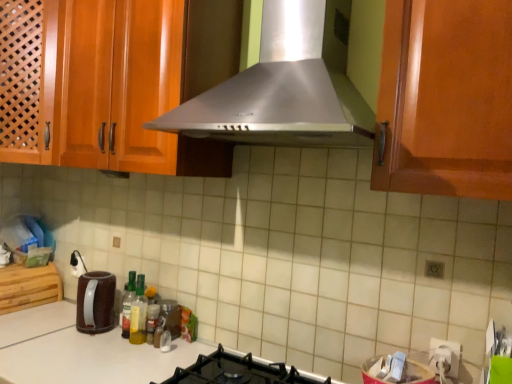
The height and width of the screenshot is (384, 512). Describe the element at coordinates (128, 304) in the screenshot. I see `translucent glass bottle at center, the third bottle positioned from the right` at that location.

Identify the location of translucent plastic bottle at center, the 3th bottle in the left-to-right sequence. (152, 321).

The height and width of the screenshot is (384, 512). Describe the element at coordinates (170, 316) in the screenshot. I see `metallic glass jar at center` at that location.

What is the approximate width of metallic glass jar at center?

It is 5.73 centimeters.

Find the location of a particular element. Image resolution: width=512 pixels, height=384 pixels. stainless steel range hood at center is located at coordinates (285, 87).

Find the location of a particular element. The height and width of the screenshot is (384, 512). brown matte electric kettle at lower left is located at coordinates (95, 302).

From the image's perspective, is stainless steel range hood at center located above brown matte electric kettle at lower left?

Yes, from the image's perspective, stainless steel range hood at center is above brown matte electric kettle at lower left.

Where is `kitchen appliance below the stainless steel range hood at center (from the image's perspective)`? kitchen appliance below the stainless steel range hood at center (from the image's perspective) is located at coordinates (95, 302).

Are stainless steel range hood at center and brown matte electric kettle at lower left making contact?

No, stainless steel range hood at center is not touching brown matte electric kettle at lower left.

From the picture: Which object is positioned more to the right, stainless steel range hood at center or brown matte electric kettle at lower left?

stainless steel range hood at center.

Is stainless steel range hood at center far from translucent plastic bottle at center, arranged as the second bottle when viewed from the right?

stainless steel range hood at center is actually quite close to translucent plastic bottle at center, arranged as the second bottle when viewed from the right.

Is point (308, 17) positioned after point (141, 286)?

No.

From the image's perspective, is stainless steel range hood at center located above or below translucent plastic bottle at center, the second bottle when ordered from left to right?

stainless steel range hood at center is situated higher than translucent plastic bottle at center, the second bottle when ordered from left to right, in the image.

Can you confirm if metallic glass jar at center is shorter than brown matte electric kettle at lower left?

Indeed, metallic glass jar at center has a lesser height compared to brown matte electric kettle at lower left.

From a real-world perspective, is metallic glass jar at center positioned under brown matte electric kettle at lower left based on gravity?

Yes, from a real-world perspective, metallic glass jar at center is beneath brown matte electric kettle at lower left.

Who is bigger, metallic glass jar at center or brown matte electric kettle at lower left?

brown matte electric kettle at lower left.

Which object is further away from the camera taking this photo, metallic glass jar at center or brown matte electric kettle at lower left?

metallic glass jar at center.

Measure the distance between translucent plastic bottle at center, arranged as the second bottle when viewed from the right, and translucent glass bottle at center, the third bottle positioned from the right.

translucent plastic bottle at center, arranged as the second bottle when viewed from the right, and translucent glass bottle at center, the third bottle positioned from the right, are 1.79 inches apart.

Is translucent plastic bottle at center, arranged as the second bottle when viewed from the right, oriented away from translucent glass bottle at center, the 1th bottle from the left?

No, translucent plastic bottle at center, arranged as the second bottle when viewed from the right, is not facing the opposite direction of translucent glass bottle at center, the 1th bottle from the left.

From the image's perspective, is translucent plastic bottle at center, arranged as the second bottle when viewed from the right, under translucent glass bottle at center, the 1th bottle from the left?

Correct, translucent plastic bottle at center, arranged as the second bottle when viewed from the right, appears lower than translucent glass bottle at center, the 1th bottle from the left, in the image.

Consider the image. Is translucent plastic bottle at center, the second bottle when ordered from left to right, thinner than translucent glass bottle at center, the 1th bottle from the left?

Yes.

In the scene shown: Is wooden cutting board at lower left not near translucent plastic bottle at center, arranged as the second bottle when viewed from the right?

Actually, wooden cutting board at lower left and translucent plastic bottle at center, arranged as the second bottle when viewed from the right, are a little close together.

Is point (59, 294) in front of point (144, 285)?

No.

Can you confirm if wooden cutting board at lower left is positioned to the right of translucent plastic bottle at center, the second bottle when ordered from left to right?

No, wooden cutting board at lower left is not to the right of translucent plastic bottle at center, the second bottle when ordered from left to right.

Can you confirm if wooden cutting board at lower left is smaller than translucent plastic bottle at center, the second bottle when ordered from left to right?

No, wooden cutting board at lower left is not smaller than translucent plastic bottle at center, the second bottle when ordered from left to right.

From their relative heights in the image, would you say black matte gas stove at lower center is taller or shorter than translucent glass bottle at center, the third bottle positioned from the right?

black matte gas stove at lower center is shorter than translucent glass bottle at center, the third bottle positioned from the right.

Measure the distance between black matte gas stove at lower center and translucent glass bottle at center, the 1th bottle from the left.

black matte gas stove at lower center is 18.85 inches from translucent glass bottle at center, the 1th bottle from the left.

Would you say black matte gas stove at lower center is a long distance from translucent glass bottle at center, the 1th bottle from the left?

They are positioned close to each other.

How many degrees apart are the facing directions of black matte gas stove at lower center and translucent glass bottle at center, the third bottle positioned from the right?

They differ by 0.461 degrees in their facing directions.

Which object is positioned more to the left, brown matte electric kettle at lower left or stainless steel range hood at center?

brown matte electric kettle at lower left.

Is brown matte electric kettle at lower left taller or shorter than stainless steel range hood at center?

Clearly, brown matte electric kettle at lower left is shorter compared to stainless steel range hood at center.

Consider the image. Are brown matte electric kettle at lower left and stainless steel range hood at center beside each other?

No, brown matte electric kettle at lower left is not with stainless steel range hood at center.

How many degrees apart are the facing directions of brown matte electric kettle at lower left and stainless steel range hood at center?

0.308 degrees separate the facing orientations of brown matte electric kettle at lower left and stainless steel range hood at center.

At what (x,y) coordinates should I click in order to perform the action: click on kitchen appliance behind the stainless steel range hood at center. Please return your answer as a coordinate pair (x, y). The height and width of the screenshot is (384, 512). Looking at the image, I should click on (95, 302).

Locate an element on the screen. The height and width of the screenshot is (384, 512). home appliance above the translucent plastic bottle at center, the second bottle when ordered from left to right (from the image's perspective) is located at coordinates (285, 87).

Looking at the image, which one is located closer to translucent plastic bottle at center, arranged as the second bottle when viewed from the right, metallic glass jar at center or black matte gas stove at lower center?

metallic glass jar at center lies closer to translucent plastic bottle at center, arranged as the second bottle when viewed from the right, than the other object.

From the image, which object appears to be nearer to translucent glass bottle at center, the 1th bottle from the left, brown matte electric kettle at lower left or black matte gas stove at lower center?

brown matte electric kettle at lower left is closer to translucent glass bottle at center, the 1th bottle from the left.

Looking at the image, which one is located further to black matte gas stove at lower center, translucent glass bottle at center, the 1th bottle from the left, or stainless steel range hood at center?

Among the two, stainless steel range hood at center is located further to black matte gas stove at lower center.

Looking at the image, which one is located closer to black matte gas stove at lower center, translucent plastic bottle at center, the second bottle when ordered from left to right, or translucent glass bottle at center, the 1th bottle from the left?

translucent plastic bottle at center, the second bottle when ordered from left to right, is positioned closer to the anchor black matte gas stove at lower center.

Considering their positions, is translucent glass bottle at center, the third bottle positioned from the right, positioned further to brown matte electric kettle at lower left than black matte gas stove at lower center?

black matte gas stove at lower center.

Estimate the real-world distances between objects in this image. Which object is closer to black matte gas stove at lower center, metallic glass jar at center or wooden cutting board at lower left?

Based on the image, metallic glass jar at center appears to be nearer to black matte gas stove at lower center.

When comparing their distances from black matte gas stove at lower center, does wooden cutting board at lower left or translucent glass bottle at center, the third bottle positioned from the right, seem closer?

translucent glass bottle at center, the third bottle positioned from the right, lies closer to black matte gas stove at lower center than the other object.

Estimate the real-world distances between objects in this image. Which object is closer to wooden cutting board at lower left, translucent glass bottle at center, the third bottle positioned from the right, or translucent plastic bottle at center, the 1th bottle when ordered from right to left?

translucent glass bottle at center, the third bottle positioned from the right, is positioned closer to the anchor wooden cutting board at lower left.

You are a GUI agent. You are given a task and a screenshot of the screen. Output one action in this format:
    pyautogui.click(x=<x>, y=<y>)
    Task: Click on the bottle between translucent glass bottle at center, the third bottle positioned from the right, and translucent plastic bottle at center, the 1th bottle when ordered from right to left
    This screenshot has width=512, height=384.
    Given the screenshot: What is the action you would take?
    pyautogui.click(x=138, y=313)

Identify the location of appliance between wooden cutting board at lower left and black matte gas stove at lower center from left to right. This screenshot has height=384, width=512. (170, 316).

The image size is (512, 384). Identify the location of kitchen appliance between wooden cutting board at lower left and stainless steel range hood at center. pyautogui.click(x=95, y=302).

Identify the location of appliance between wooden cutting board at lower left and stainless steel range hood at center. The image size is (512, 384). (170, 316).